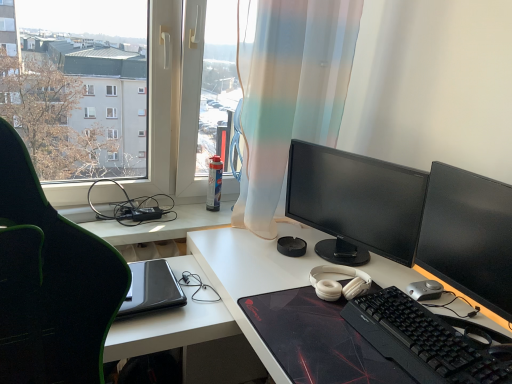
This screenshot has width=512, height=384. In order to click on vacant space in black glossy monitor at right, the first computer monitor from the front (from a real-world perspective) in this screenshot , I will do `click(441, 310)`.